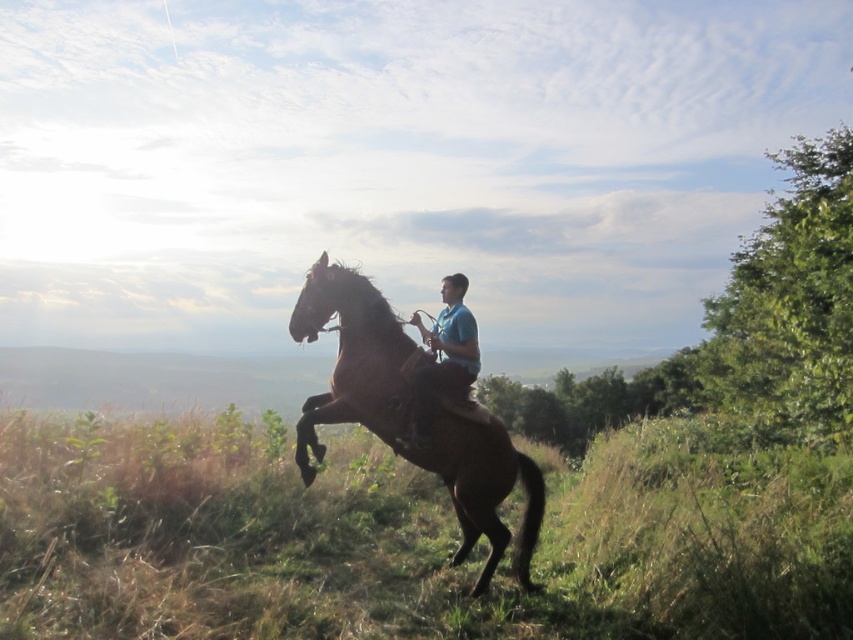
Question: Can you confirm if brown grassy at center is positioned below blue smooth shirt at center?

Choices:
 (A) no
 (B) yes

Answer: (B)

Question: Is brown grassy at center further to camera compared to brown glossy horse at center?

Choices:
 (A) no
 (B) yes

Answer: (A)

Question: Which object is closer to the camera taking this photo?

Choices:
 (A) blue smooth shirt at center
 (B) brown grassy at center
 (C) brown glossy horse at center

Answer: (B)

Question: Which point is closer to the camera?

Choices:
 (A) blue smooth shirt at center
 (B) brown grassy at center
 (C) brown glossy horse at center

Answer: (B)

Question: Does brown grassy at center appear over brown glossy horse at center?

Choices:
 (A) yes
 (B) no

Answer: (B)

Question: Which of the following is the closest to the observer?

Choices:
 (A) brown glossy horse at center
 (B) brown grassy at center
 (C) blue smooth shirt at center

Answer: (B)